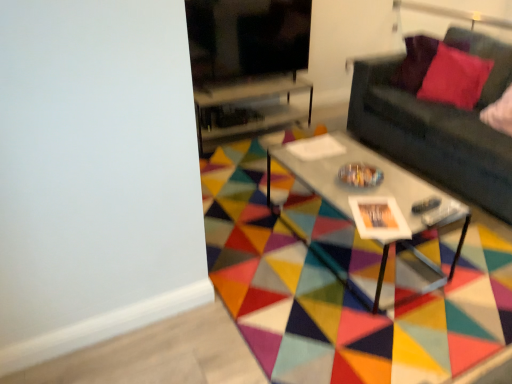
Question: Is geometric multicolored rug at center situated inside metallic gray coffee table at center or outside?

Choices:
 (A) outside
 (B) inside

Answer: (A)

Question: Is geometric multicolored rug at center in front of or behind metallic gray coffee table at center in the image?

Choices:
 (A) front
 (B) behind

Answer: (A)

Question: Considering the real-world distances, which object is farthest from the geometric multicolored rug at center?

Choices:
 (A) metallic gray coffee table at center
 (B) velvet red pillow at upper right
 (C) velvet red pillow at upper right
 (D) transparent glass table at center
 (E) dark gray fabric couch at right

Answer: (C)

Question: Which of these objects is positioned farthest from the dark gray fabric couch at right?

Choices:
 (A) geometric multicolored rug at center
 (B) transparent glass table at center
 (C) metallic gray coffee table at center
 (D) velvet red pillow at upper right
 (E) velvet red pillow at upper right

Answer: (B)